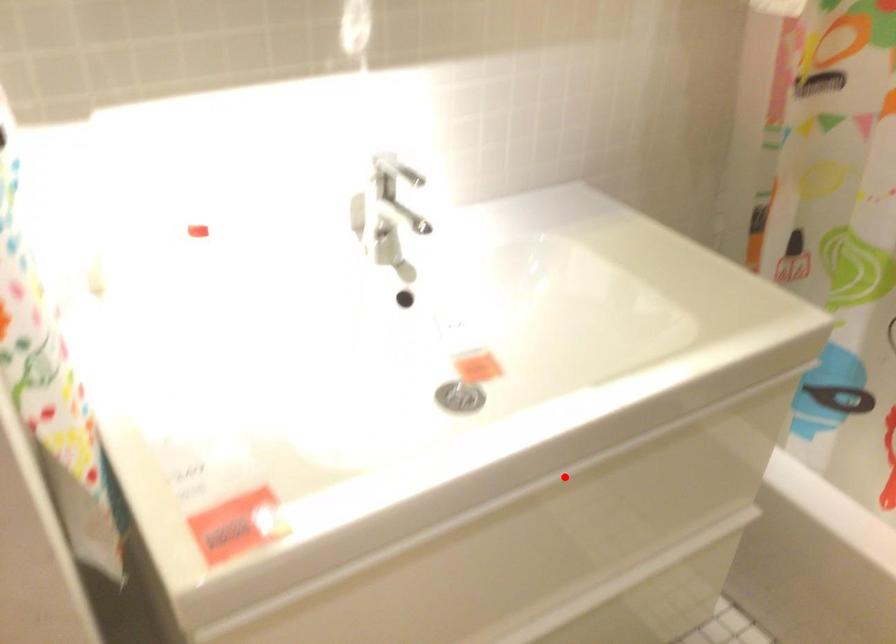
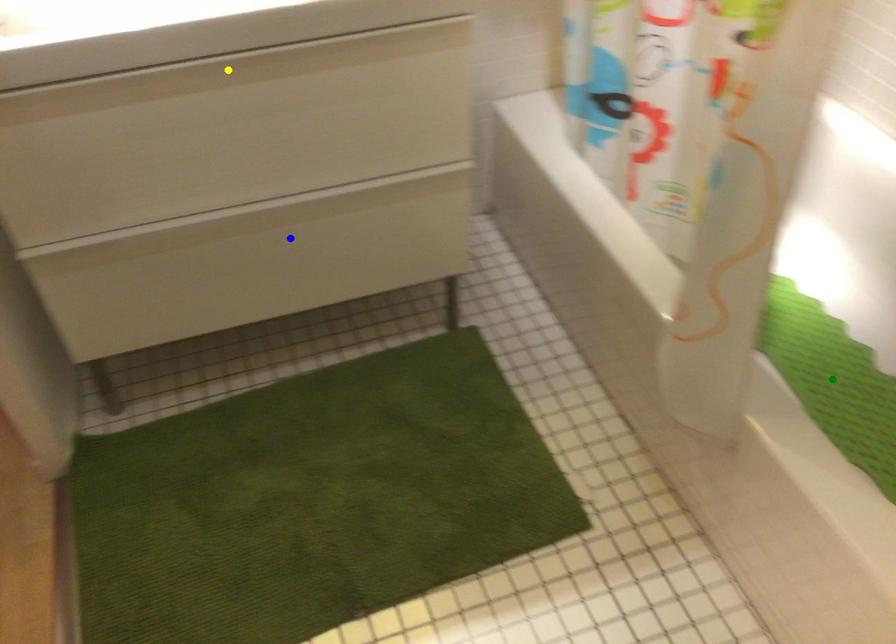
Question: I am providing you with two images of the same scene from different viewpoints. A red point is marked on the first image. You are given multiple points on the second image. Which mark in image 2 goes with the point in image 1?

Choices:
 (A) blue point
 (B) green point
 (C) yellow point

Answer: (C)